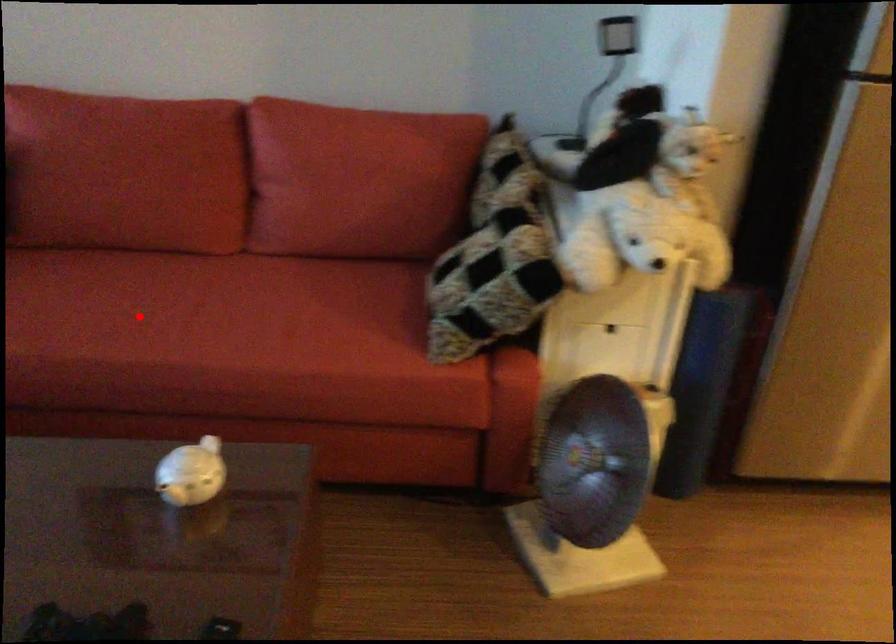
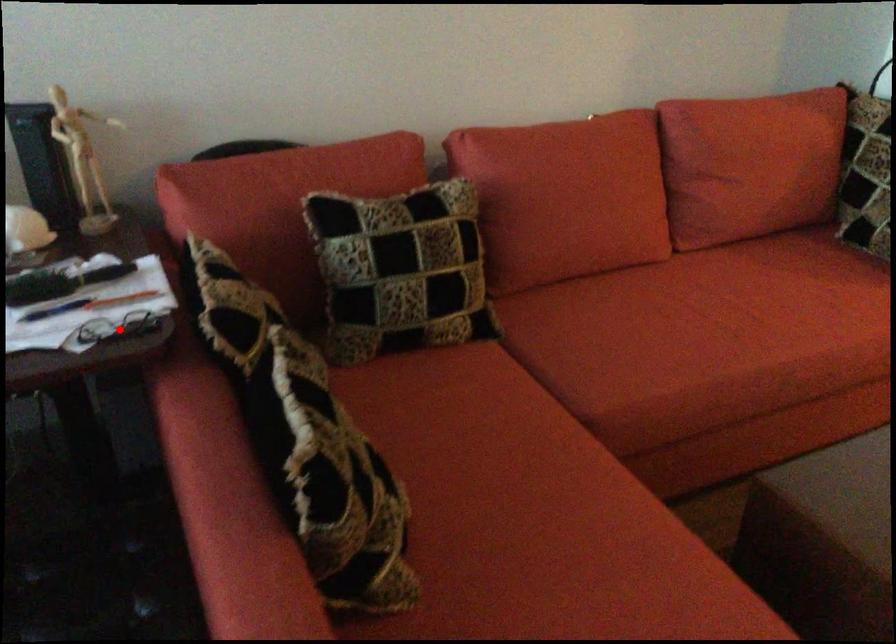
I am providing you with two images of the same scene from different viewpoints. A red point is marked on the first image and another point is marked on the second image. Is the marked point in image1 the same physical position as the marked point in image2?

No